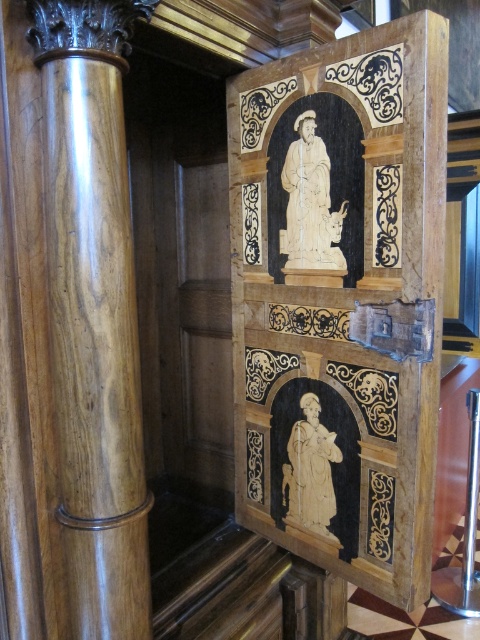
Looking at this image, you are standing in front of the wooden panel described in the scene. A guide tells you that there is a white carved wood statue at center located at coordinates point 0.298, 0.646. If you were to draw a straight line from your current position to the statue, would it pass through any other object mentioned in the scene?

The white carved wood statue at center is the only object mentioned in the scene, so drawing a straight line to it would not pass through any other object mentioned.

You are an interior designer planning to place a new decorative item between the marble panel at center and the polished wood column at left. Based on their widths, which object should you consider placing closer to the narrower one to ensure proper spacing?

The polished wood column at left is narrower than the marble panel at center, so you should place the new decorative item closer to the polished wood column at left to maintain proper spacing.